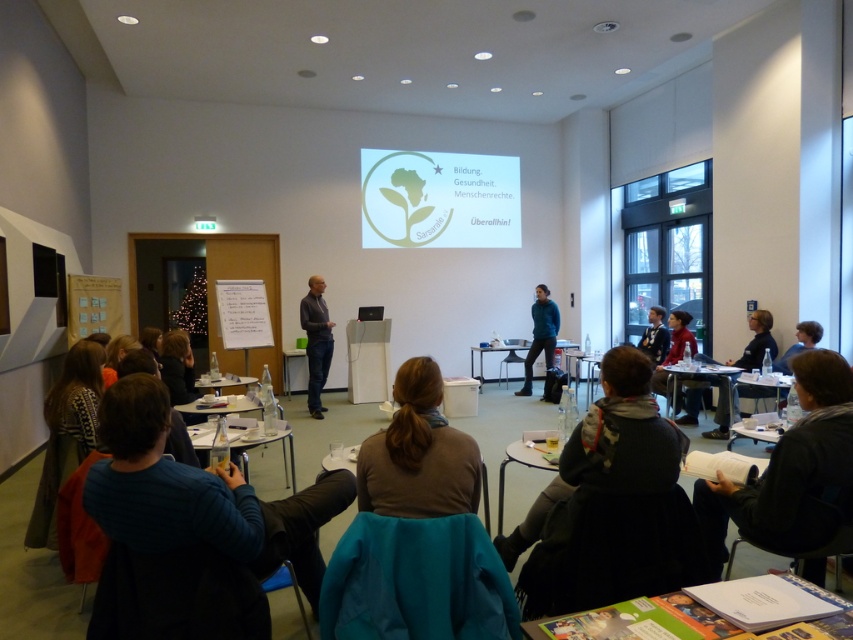
Who is positioned more to the left, white plastic table at lower right or matte plastic table at center?

matte plastic table at center

Is white plastic table at lower right thinner than matte plastic table at center?

Incorrect, white plastic table at lower right's width is not less than matte plastic table at center's.

Is point (782, 376) positioned after point (285, 360)?

No, (782, 376) is in front of (285, 360).

I want to click on white plastic table at lower right, so click(759, 388).

Is paper-covered table at lower center further to camera compared to dark gray sweater at lower center?

That is False.

Is paper-covered table at lower center smaller than dark gray sweater at lower center?

Yes.

Between point (711, 630) and point (561, 419), which one is positioned in front?

Point (711, 630) is in front.

In order to click on paper-covered table at lower center in this screenshot , I will do `click(676, 612)`.

Who is more forward, [817,355] or [610,392]?

Point [610,392] is in front.

Does dark gray sweater at lower right appear under dark gray sweater at lower center?

No, dark gray sweater at lower right is not below dark gray sweater at lower center.

Is point (798, 396) positioned behind point (537, 538)?

No, it is not.

The height and width of the screenshot is (640, 853). What are the coordinates of `dark gray sweater at lower right` in the screenshot? It's located at (792, 472).